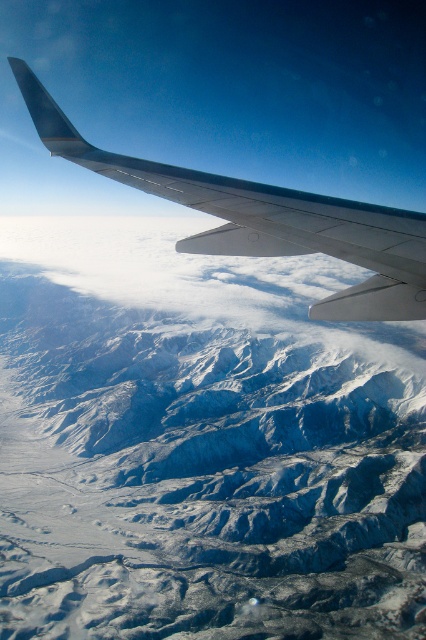
You are a pilot observing the view from the airplane window. You notice the snowy rocky mountain range at upper center and the metallic gray wing at upper center. Which object appears wider from your perspective?

The snowy rocky mountain range at upper center appears wider than the metallic gray wing at upper center because its width surpasses that of the metallic gray wing at upper center.

You are a passenger on an airplane and looking out the window. You notice the snowy rocky mountain range at upper center and the metallic gray wing at upper center. Which object is closer to you?

The metallic gray wing at upper center is closer to you because it is positioned above the snowy rocky mountain range at upper center.

You are an airplane passenger looking out the window. You see two points in the scene labeled as point (97, 413) and point (403, 262). Which point is closer to the airplane wing?

Point (403, 262) is closer to the airplane wing because it is in front of point (97, 413), which is behind it.